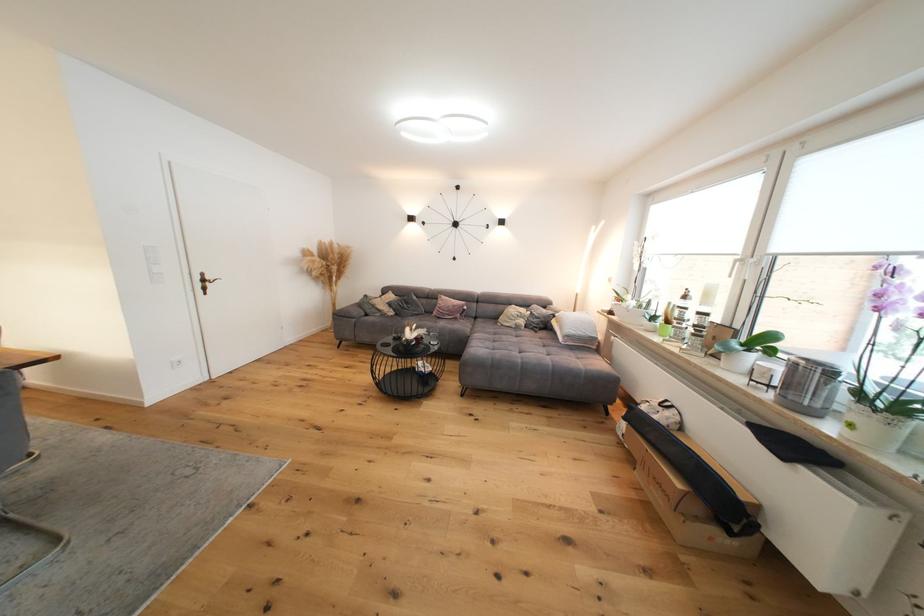
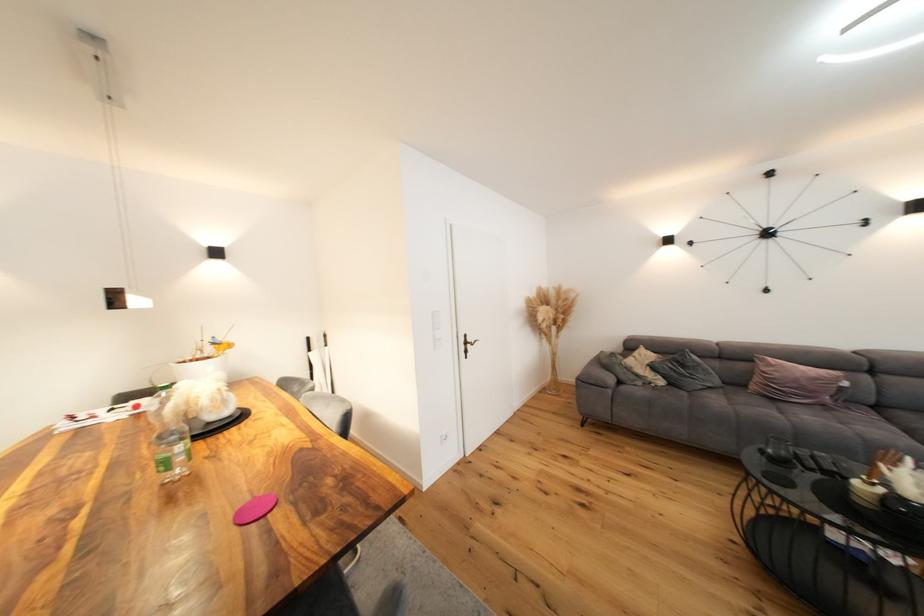
Where in the second image is the point corresponding to pixel 331 290 from the first image?

(548, 342)